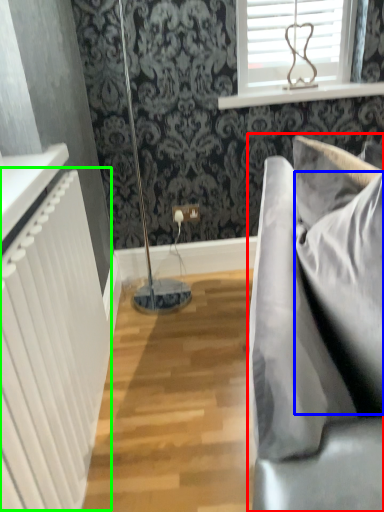
Question: Which is farther away from studio couch (highlighted by a red box)? pillow (highlighted by a blue box) or radiator (highlighted by a green box)?

Choices:
 (A) pillow
 (B) radiator

Answer: (B)